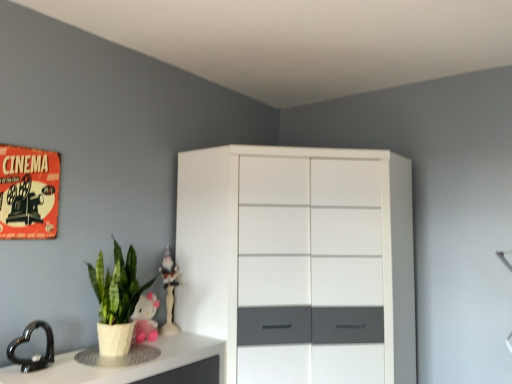
At what (x,y) coordinates should I click in order to perform the action: click on unoccupied region to the right of black glossy heart at lower left. Please return your answer as a coordinate pair (x, y). This screenshot has width=512, height=384. Looking at the image, I should click on (66, 370).